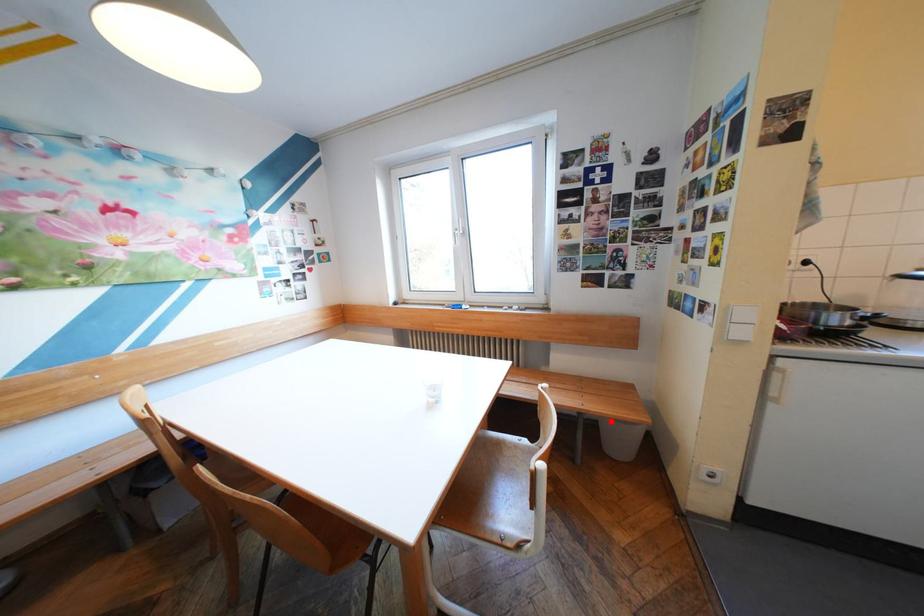
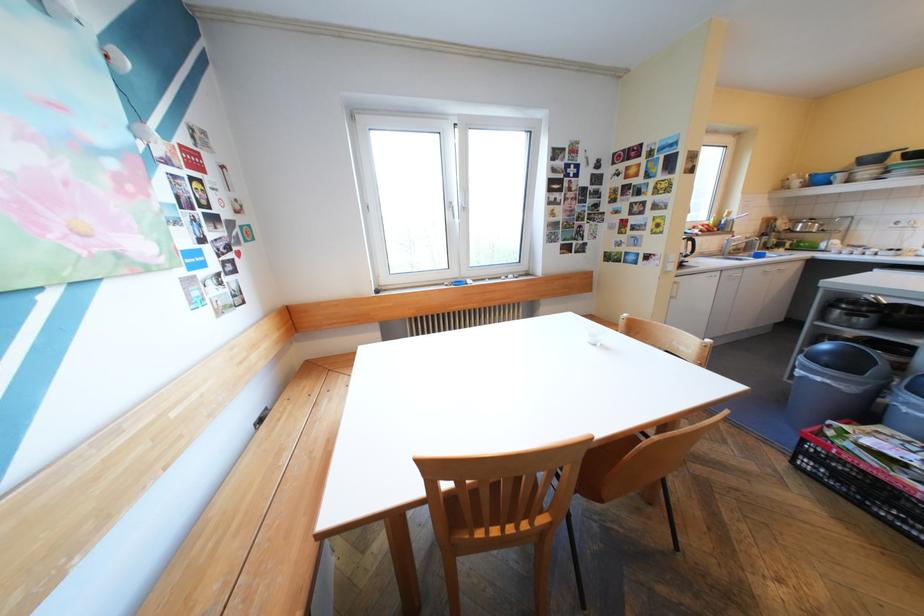
Question: I am providing you with two images of the same scene from different viewpoints. A red point is marked on the first image. At the location where the point appears in image 1, is it still visible in image 2?

Choices:
 (A) Yes
 (B) No

Answer: (B)